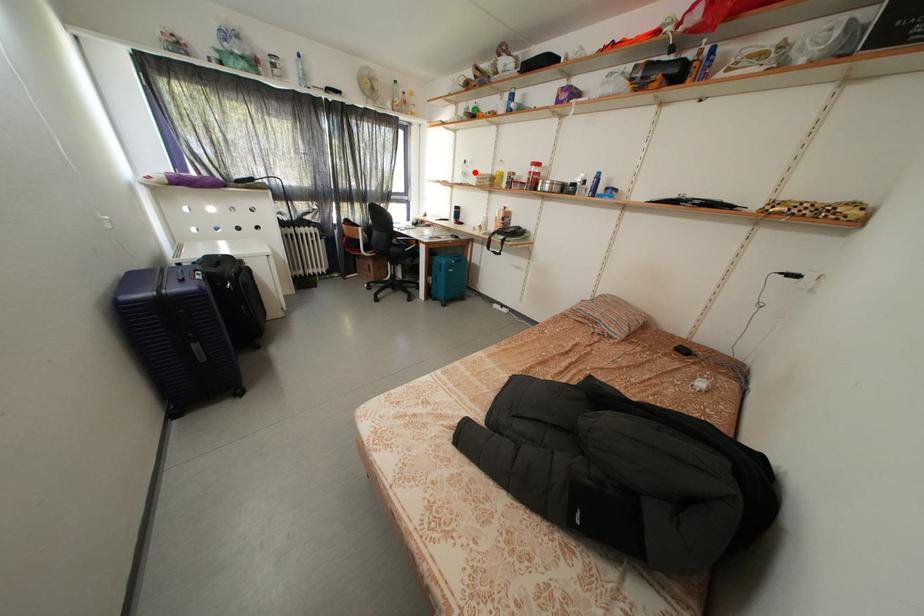
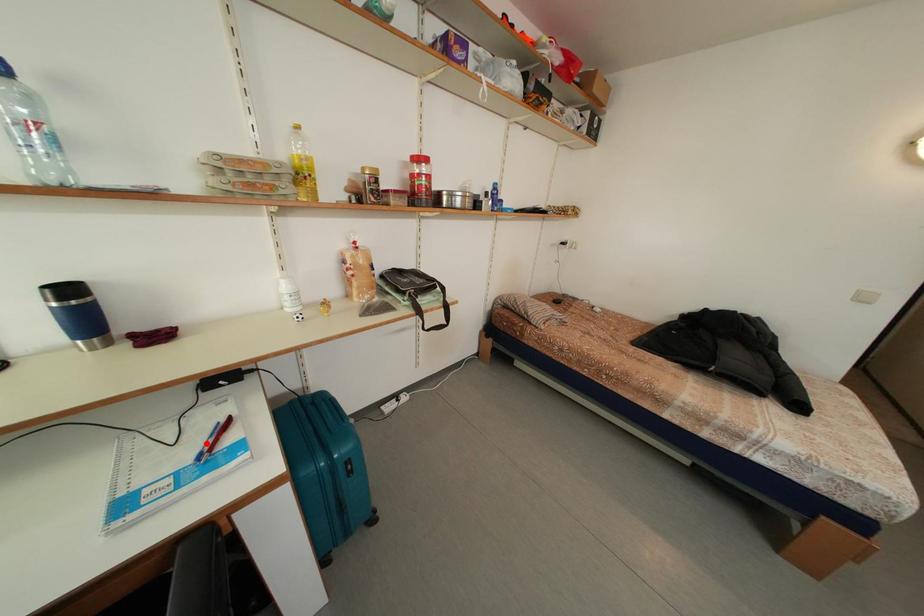
I am providing you with two images of the same scene from different viewpoints. A red point is marked on the first image and another point is marked on the second image. Does the point marked in image1 correspond to the same location as the one in image2?

No